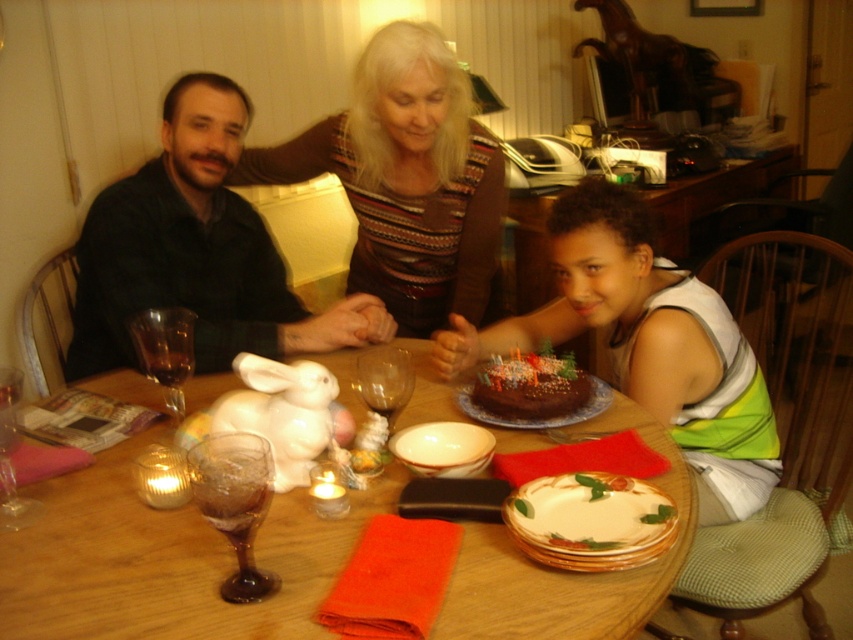
Does brown textured sweater at upper center appear on the right side of matte chocolate cake at center?

No, brown textured sweater at upper center is not to the right of matte chocolate cake at center.

At what (x,y) coordinates should I click in order to perform the action: click on brown textured sweater at upper center. Please return your answer as a coordinate pair (x, y). Image resolution: width=853 pixels, height=640 pixels. Looking at the image, I should click on (407, 180).

Is transparent glass wine glass at center smaller than transparent glass at table left?

Indeed, transparent glass wine glass at center has a smaller size compared to transparent glass at table left.

Which is more to the right, transparent glass wine glass at center or transparent glass at table left?

transparent glass wine glass at center

Measure the distance between transparent glass wine glass at center and camera.

1.25 meters

Where is `transparent glass wine glass at center`? transparent glass wine glass at center is located at coordinates (384, 380).

Can you confirm if matte chocolate cake at center is shorter than transparent glass wine glass at table left?

A: Incorrect, matte chocolate cake at center's height does not fall short of transparent glass wine glass at table left's.

Who is lower down, matte chocolate cake at center or transparent glass wine glass at table left?

matte chocolate cake at center is below.

Based on the photo, who is more forward, (682, 284) or (175, 378)?

Positioned in front is point (175, 378).

Identify the location of matte chocolate cake at center. (646, 342).